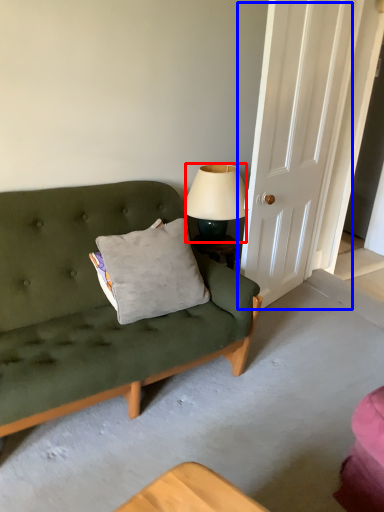
Question: Which object is closer to the camera taking this photo, lamp (highlighted by a red box) or door (highlighted by a blue box)?

Choices:
 (A) lamp
 (B) door

Answer: (B)